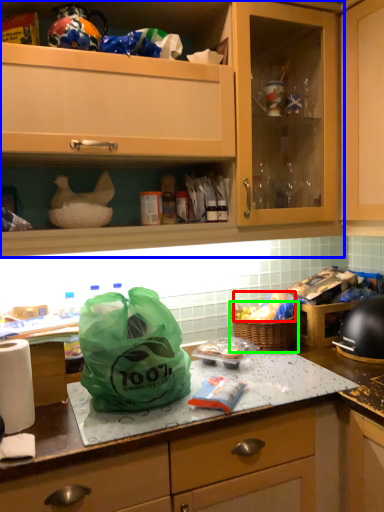
Question: Based on their relative distances, which object is farther from food (highlighted by a red box)? Choose from cabinetry (highlighted by a blue box) and picnic basket (highlighted by a green box).

Choices:
 (A) cabinetry
 (B) picnic basket

Answer: (A)